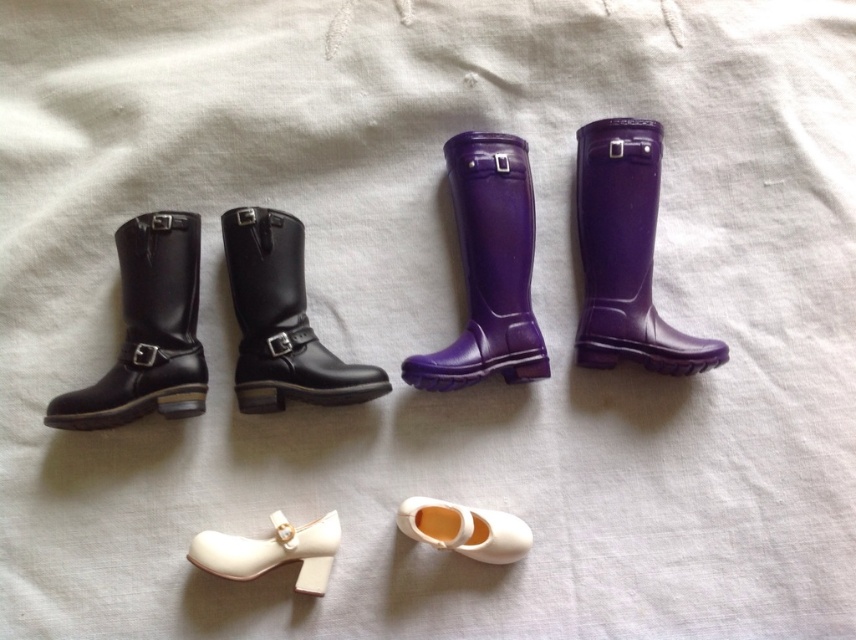
Between glossy rubber boot at upper right and white matte shoe at lower center, which one has less height?

Standing shorter between the two is white matte shoe at lower center.

Is glossy rubber boot at upper right positioned in front of white matte shoe at lower center?

That is False.

Which is behind, point (720, 346) or point (328, 573)?

Positioned behind is point (720, 346).

This screenshot has width=856, height=640. In order to click on glossy rubber boot at upper right in this screenshot , I will do `click(625, 253)`.

Who is more distant from viewer, (x=348, y=380) or (x=217, y=564)?

The point (x=348, y=380) is behind.

Does black leather boot at center have a greater height compared to white matte shoe at lower center?

Indeed, black leather boot at center has a greater height compared to white matte shoe at lower center.

Locate an element on the screen. black leather boot at center is located at coordinates (281, 321).

Between point (629, 212) and point (265, 317), which one is positioned in front?

Point (265, 317) is more forward.

Can you confirm if glossy rubber boot at upper right is smaller than black leather boot at center?

Incorrect, glossy rubber boot at upper right is not smaller in size than black leather boot at center.

Find the location of a particular element. glossy rubber boot at upper right is located at coordinates (625, 253).

This screenshot has width=856, height=640. What are the coordinates of `glossy rubber boot at upper right` in the screenshot? It's located at (625, 253).